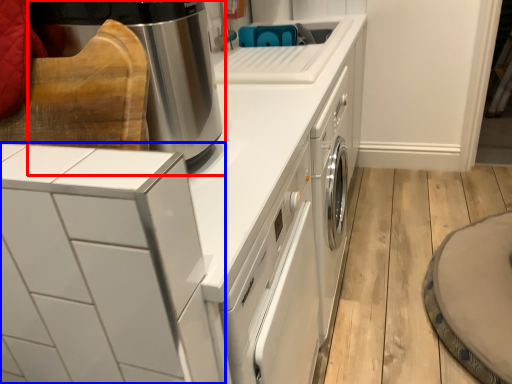
Question: Which object appears farthest to the camera in this image, home appliance (highlighted by a red box) or home appliance (highlighted by a blue box)?

Choices:
 (A) home appliance
 (B) home appliance

Answer: (A)